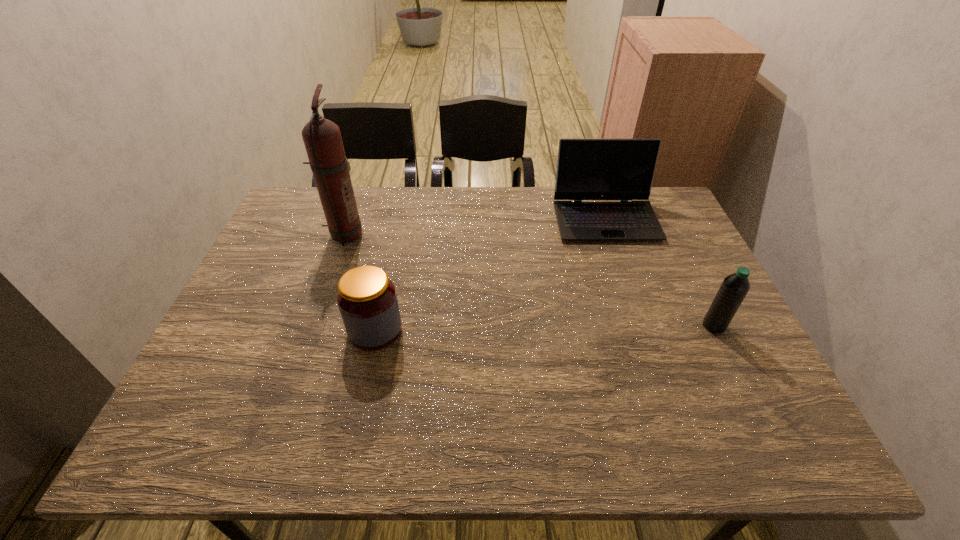
Where is `free space that satisfies the following two spatial constraints: 1. on the side of the water bottle with the label and nozzle; 2. on the right side of the fire extinguisher`? The width and height of the screenshot is (960, 540). free space that satisfies the following two spatial constraints: 1. on the side of the water bottle with the label and nozzle; 2. on the right side of the fire extinguisher is located at coordinates (311, 326).

At what (x,y) coordinates should I click in order to perform the action: click on free space that satisfies the following two spatial constraints: 1. on the screen of the laptop computer; 2. on the side of the leftmost object with the label and nozzle. Please return your answer as a coordinate pair (x, y). The image size is (960, 540). Looking at the image, I should click on (611, 234).